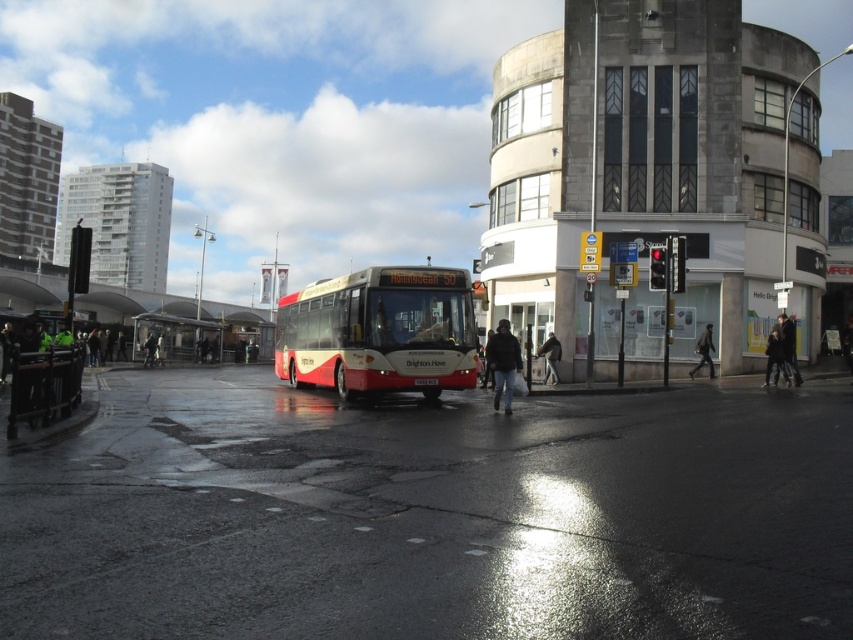
Based on the photo, you are a delivery person who needs to load a package onto a cart that can only handle items no taller than the dark gray jacket at center. Can the red matte bus at center be loaded onto the cart?

The red matte bus at center is much taller than the dark gray jacket at center, so it cannot be loaded onto the cart.

From the picture: You are standing at point [798,378] and want to walk to point [135,348]. Which direction should you face to move towards your destination?

You should face downward because point [135,348] is behind point [798,378].

You are a pedestrian standing on the sidewalk and see the red matte bus at center and the dark gray jacket at center. Which object takes up more space in the scene?

The red matte bus at center is larger in size than the dark gray jacket at center, so it takes up more space in the scene.